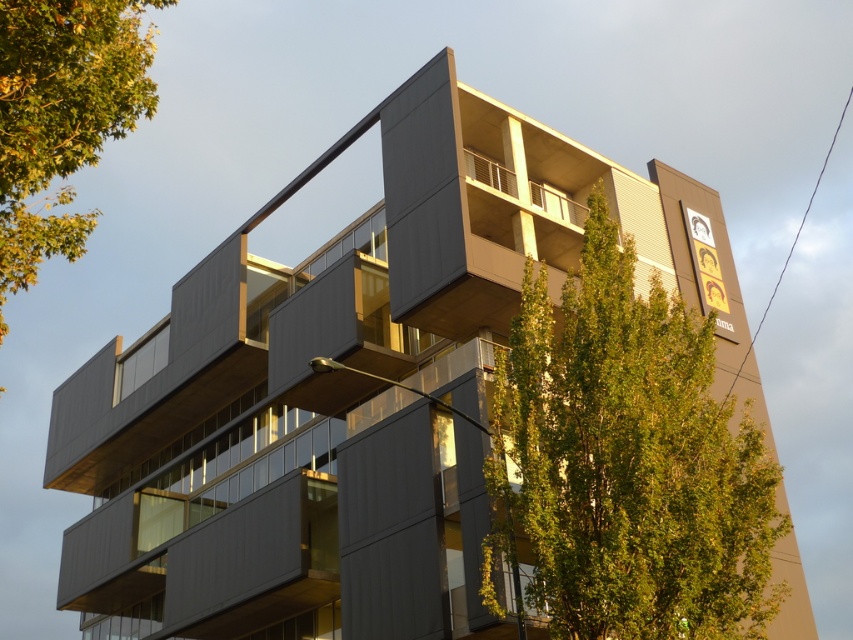
You are a landscape architect planning to add more trees to the building. Given the green leafy tree at upper center and the green leafy tree at upper left, which one has more space available for growth?

The green leafy tree at upper left has more space available for growth since it occupies more space than the green leafy tree at upper center.